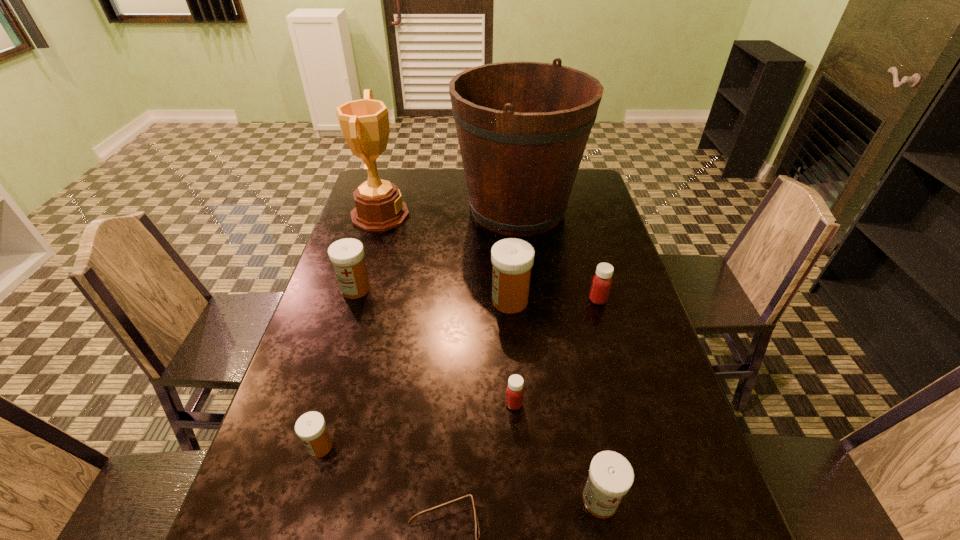
In order to click on the smallest white medicine in this screenshot , I will do `click(311, 428)`.

Image resolution: width=960 pixels, height=540 pixels. What are the coordinates of `the second nearest medicine` in the screenshot? It's located at (311, 428).

Locate an element on the screen. The image size is (960, 540). the left red medicine is located at coordinates (514, 393).

You are a GUI agent. You are given a task and a screenshot of the screen. Output one action in this format:
    pyautogui.click(x=<x>, y=<y>)
    Task: Click on the smaller red medicine
    This screenshot has width=960, height=540.
    Given the screenshot: What is the action you would take?
    pyautogui.click(x=514, y=393)

Locate an element on the screen. The height and width of the screenshot is (540, 960). free location located on the right of the bucket is located at coordinates (603, 209).

Identify the location of vacant space located on the front-facing side of the award. (519, 215).

Locate an element on the screen. free region located 0.210m on the left of the tallest medicine is located at coordinates (416, 301).

Find the location of `vacant space located 0.050m on the back of the sixth shortest object`. vacant space located 0.050m on the back of the sixth shortest object is located at coordinates (362, 267).

Where is `free region located on the left of the bigger red medicine`? Image resolution: width=960 pixels, height=540 pixels. free region located on the left of the bigger red medicine is located at coordinates (483, 300).

I want to click on vacant space located on the left of the nearest medicine, so click(x=420, y=500).